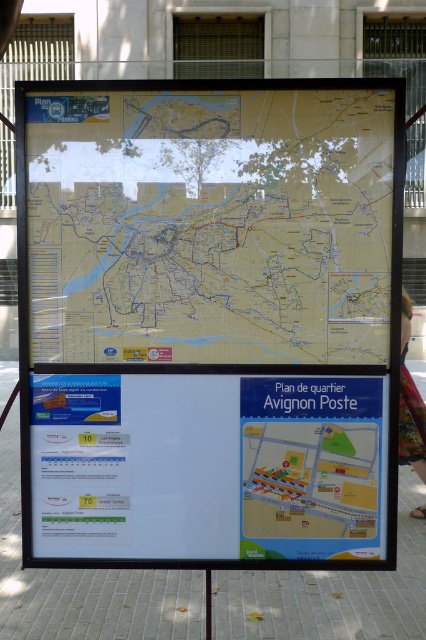
You are looking at the map of Avignon on the board. Where exactly is the white paper at center located on the map?

The white paper at center is located at the coordinates point (207,467) on the map.

You are standing in front of the large informational board. You see a white paper at center and a blue paper map at center. Which one is taller?

The white paper at center is much taller than the blue paper map at center.